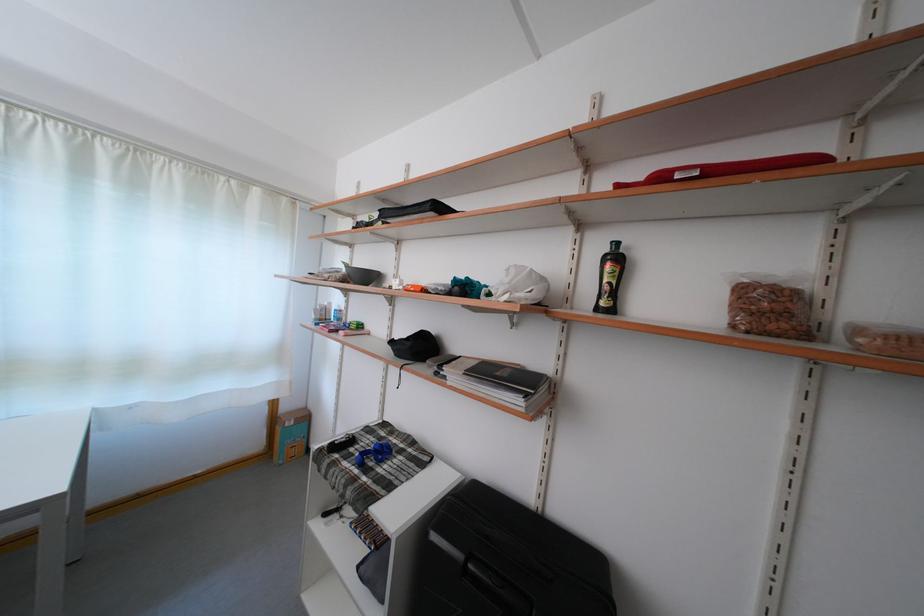
Find where to pull the black suitcase handle. Please return your answer as a coordinate pair (x, y).

(492, 529)